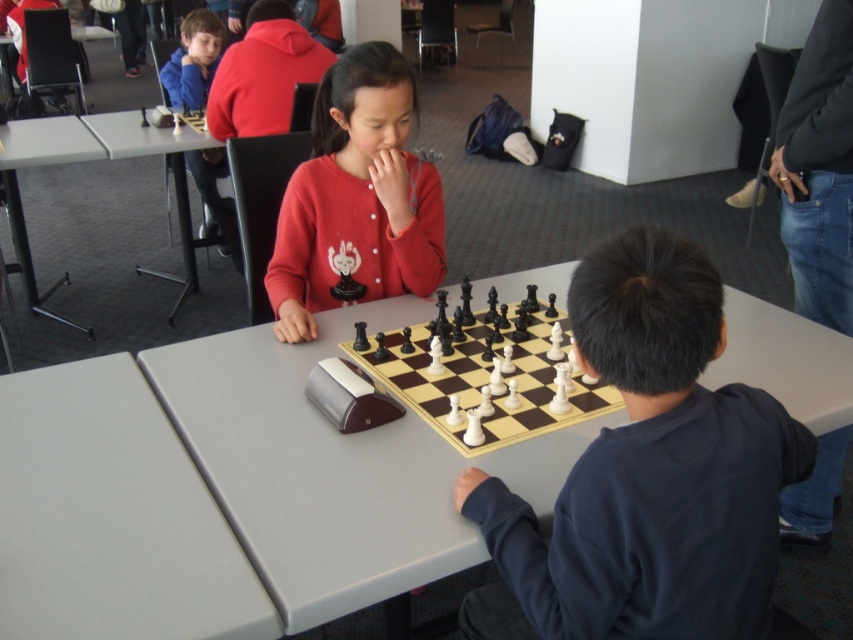
Question: Which of these objects is positioned closest to the matte red sweater at center?

Choices:
 (A) smooth gray table at center
 (B) gray plastic table at lower left
 (C) gray plastic table at upper left
 (D) black glossy chess set at center

Answer: (A)

Question: Which object is the farthest from the gray plastic table at lower left?

Choices:
 (A) dark blue sweatshirt at right
 (B) smooth gray table at center

Answer: (A)

Question: Which is nearer to the matte red sweater at center?

Choices:
 (A) smooth gray table at center
 (B) black glossy chess set at center
 (C) gray plastic table at upper left

Answer: (A)

Question: Does matte red sweater at center appear over gray plastic table at upper left?

Choices:
 (A) yes
 (B) no

Answer: (B)

Question: Is dark blue sweatshirt at right smaller than matte red sweater at center?

Choices:
 (A) yes
 (B) no

Answer: (B)

Question: Is dark blue sweatshirt at right to the left of black glossy chess set at center from the viewer's perspective?

Choices:
 (A) no
 (B) yes

Answer: (A)